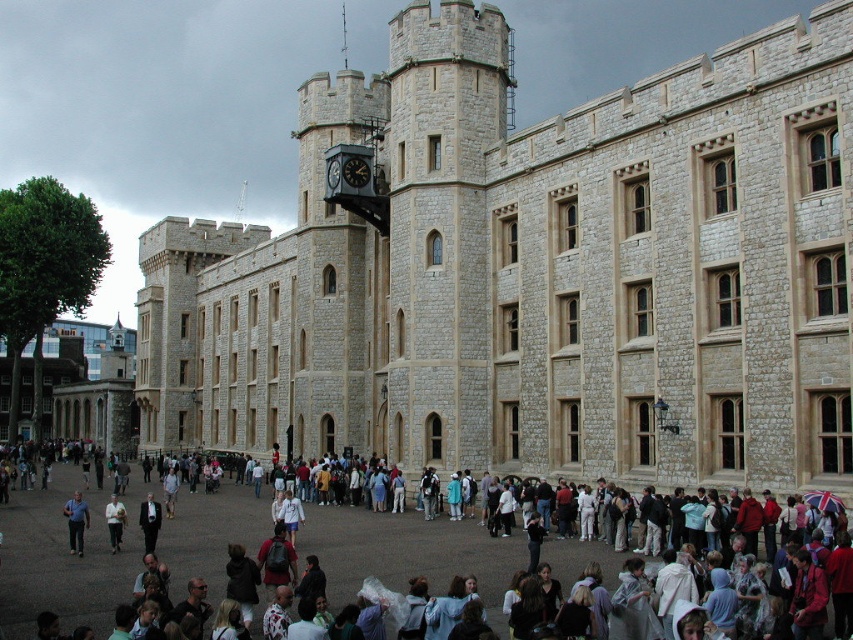
You are standing in the courtyard and want to take a photo of the dark suit at center without the beige stone tower at center blocking the view. Is this possible?

The beige stone tower at center is closer to the viewer than the dark suit at center, so the tower would block the view of the dark suit at center. Therefore, it is not possible to take a photo of the dark suit at center without the beige stone tower at center blocking the view.

You are standing in the courtyard of the castle and want to take a photo of both point (x=80, y=497) and point (x=144, y=531) in the frame. Which point should you focus on first to ensure both are in sharp focus?

You should focus on point (x=80, y=497) first because it is closer to the camera than point (x=144, y=531). By focusing on the closer point, the farther point will also be in focus due to the depth of field.

You are standing in the courtyard of the historic stone building and notice a point marked at coordinates (76, 522). Which object in the scene does this point correspond to?

The point at coordinates (76, 522) corresponds to the blue shirt at center.